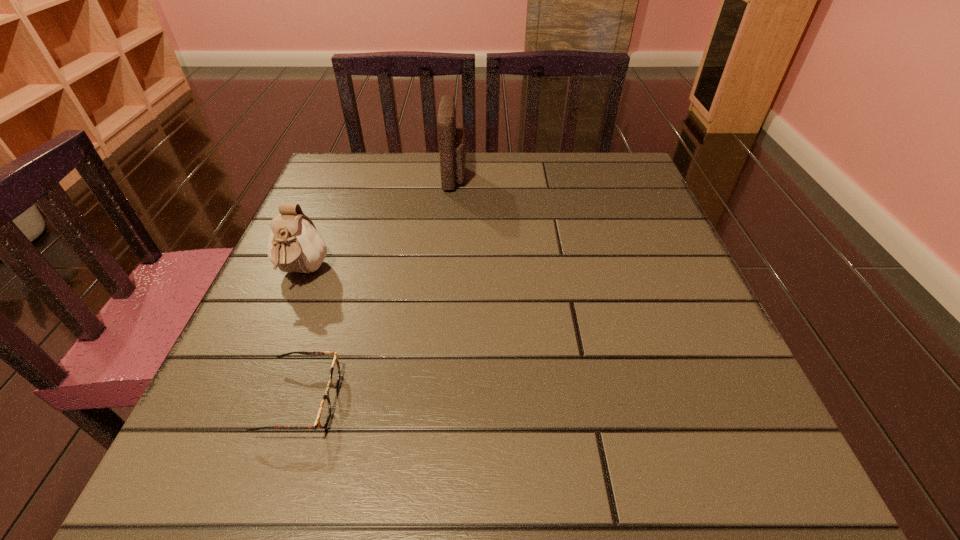
In order to click on the taller pouch in this screenshot , I will do `click(452, 141)`.

At what (x,y) coordinates should I click in order to perform the action: click on the tallest object. Please return your answer as a coordinate pair (x, y). Looking at the image, I should click on (452, 141).

This screenshot has height=540, width=960. I want to click on the nearer pouch, so click(x=294, y=245).

Where is `the second farthest object`? This screenshot has width=960, height=540. the second farthest object is located at coordinates (294, 245).

Where is `spectacles`? Image resolution: width=960 pixels, height=540 pixels. spectacles is located at coordinates (324, 412).

Image resolution: width=960 pixels, height=540 pixels. I want to click on the nearest object, so click(324, 412).

The width and height of the screenshot is (960, 540). Identify the location of vacant space located with an open flap on the farthest object. (519, 177).

Find the location of a particular element. Image resolution: width=960 pixels, height=540 pixels. vacant space located 0.210m on the front-facing side of the second farthest object is located at coordinates (249, 399).

At what (x,y) coordinates should I click in order to perform the action: click on free space located on the frame of the shortest object. Please return your answer as a coordinate pair (x, y). Looking at the image, I should click on (479, 400).

The image size is (960, 540). Identify the location of object that is at the far edge. (452, 141).